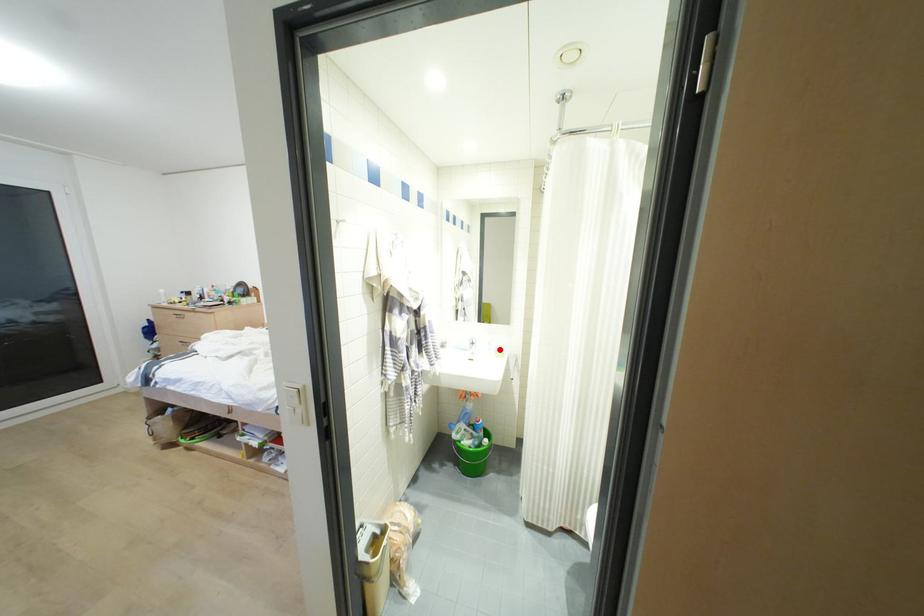
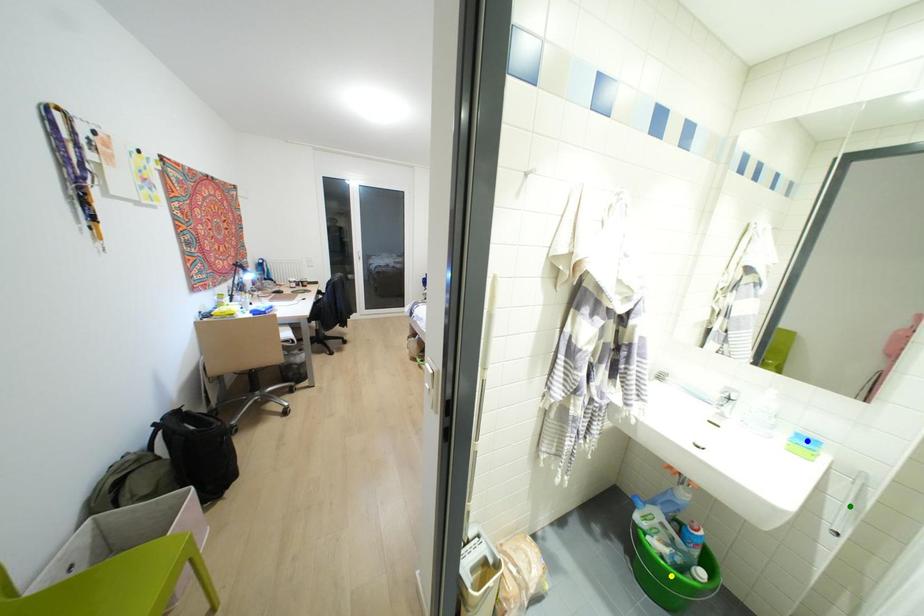
Question: I am providing you with two images of the same scene from different viewpoints. A red point is marked on the first image. You are given multiple points on the second image. Which mark in image 2 goes with the point in image 1?

Choices:
 (A) green point
 (B) blue point
 (C) yellow point

Answer: (B)